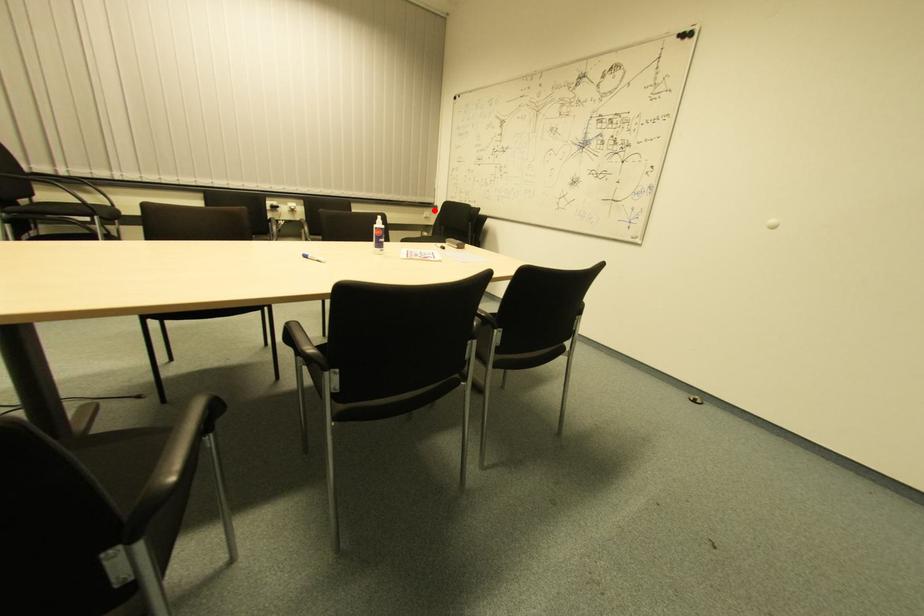
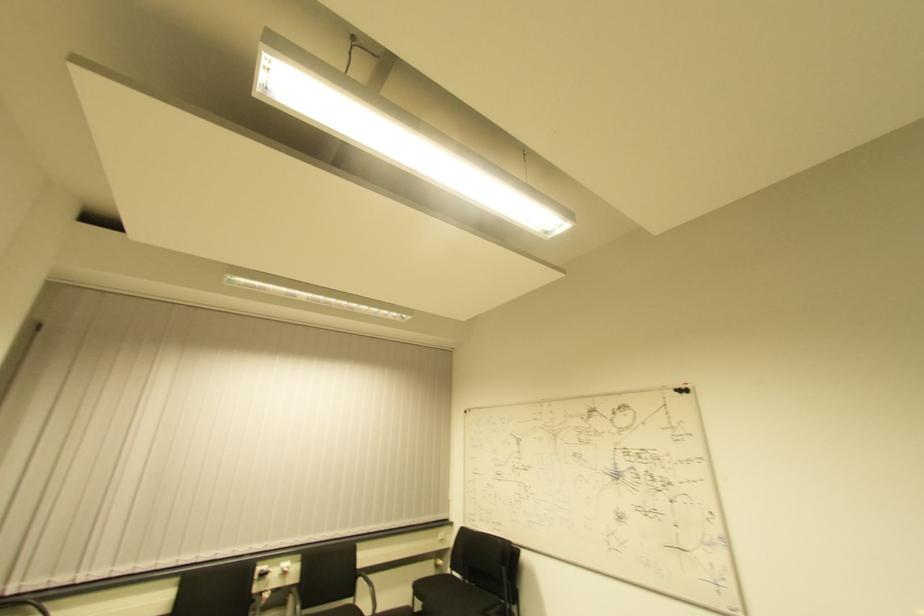
Question: I am providing you with two images of the same scene from different viewpoints. Image1 has a red point marked. In image2, the corresponding 3D location appears at what relative position? Reply with the corresponding letter.

Choices:
 (A) Closer
 (B) Farther

Answer: (B)